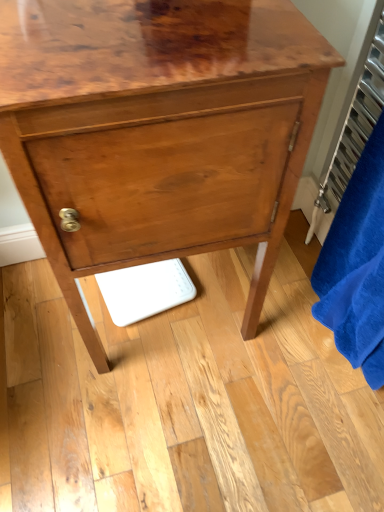
You are a GUI agent. You are given a task and a screenshot of the screen. Output one action in this format:
    pyautogui.click(x=<x>, y=<y>)
    Task: Click on the free location to the left of blue plush bath towel at right
    This screenshot has width=384, height=512.
    Given the screenshot: What is the action you would take?
    pyautogui.click(x=255, y=334)